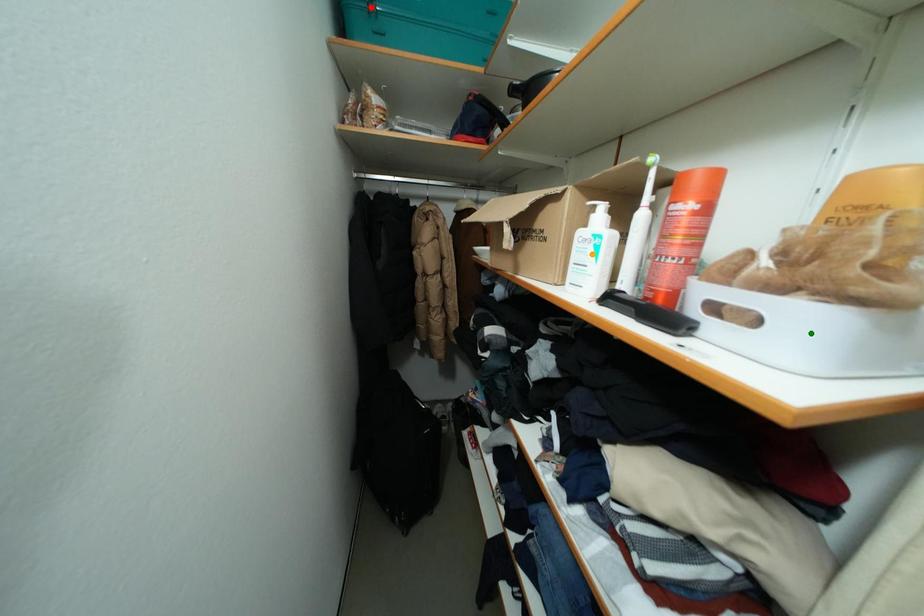
Order these from farthest to nearest:
orange point, green point, red point

red point → orange point → green point